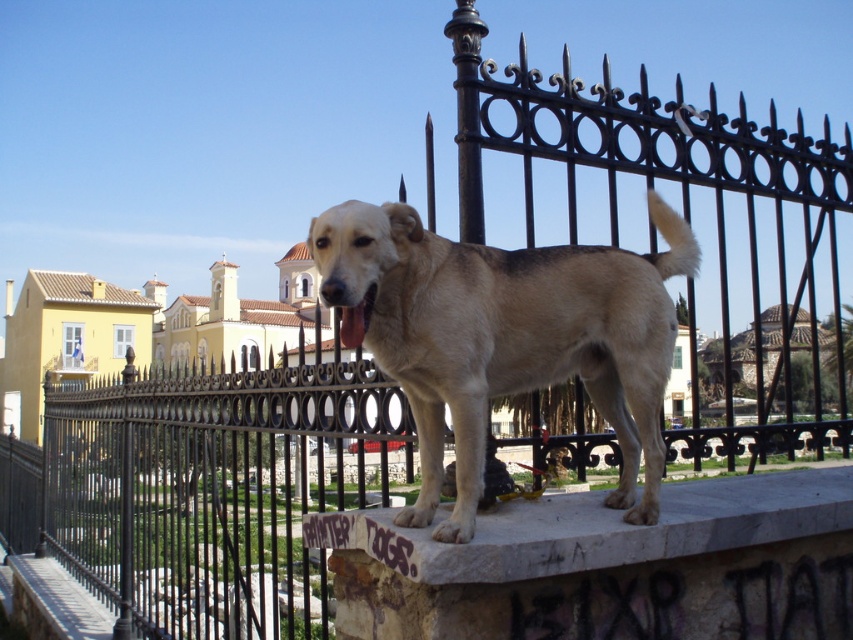
You are a dog owner who wants to ensure your dog stays comfortable. The dog is currently on the marble ledge at center and has its pink glossy tongue at center hanging out. Considering the size of the objects, which object would provide more space for the dog to rest comfortably?

The marble ledge at center is bigger than the pink glossy tongue at center, so the dog would have more space to rest comfortably on the marble ledge at center.